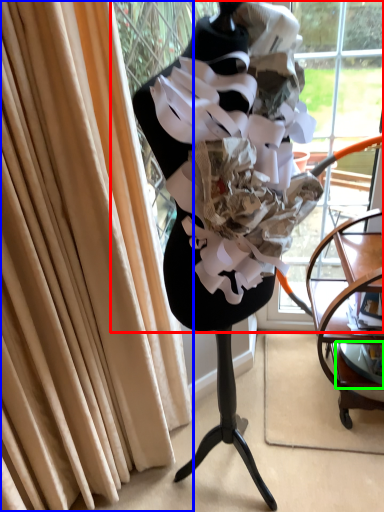
Question: Based on their relative distances, which object is nearer to shop window (highlighted by a red box)? Choose from curtain (highlighted by a blue box) and shelf (highlighted by a green box).

Choices:
 (A) curtain
 (B) shelf

Answer: (A)